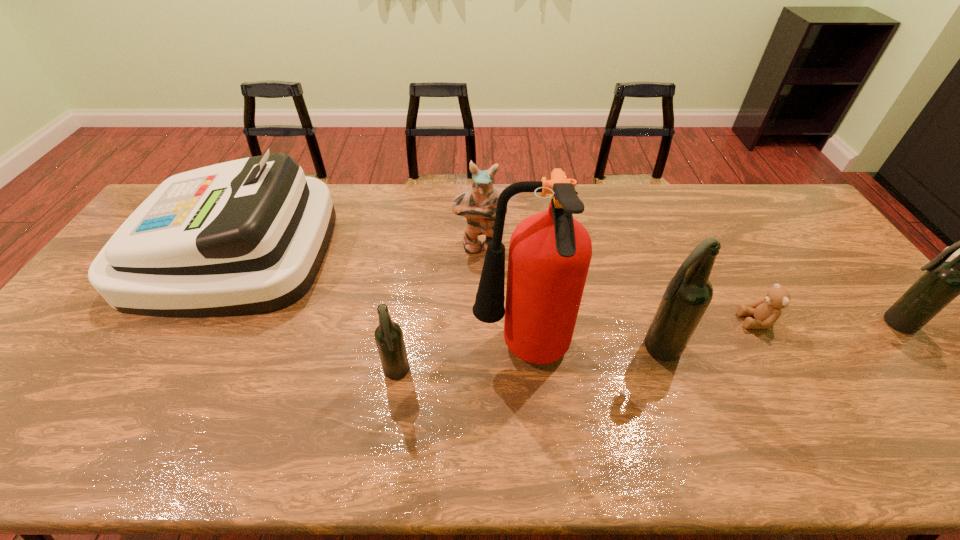
Find the location of `object that is the fourth nearest to the figurine`. object that is the fourth nearest to the figurine is located at coordinates (688, 294).

The image size is (960, 540). In order to click on the second closest object to the figurine in this screenshot , I will do `click(388, 335)`.

Identify which beer bottle is located as the second nearest to the cash register. Please provide its 2D coordinates. Your answer should be formatted as a tuple, i.e. [(x, y)], where the tuple contains the x and y coordinates of a point satisfying the conditions above.

[(688, 294)]

This screenshot has width=960, height=540. I want to click on beer bottle that is the third closest one to the figurine, so click(x=943, y=281).

Image resolution: width=960 pixels, height=540 pixels. I want to click on vacant point that satisfies the following two spatial constraints: 1. on the face of the second shortest beer bottle; 2. on the right side of the shortest object, so click(x=757, y=323).

At what (x,y) coordinates should I click in order to perform the action: click on free space that satisfies the following two spatial constraints: 1. on the front-facing side of the figurine; 2. on the left side of the second beer bottle from left to right. Please return your answer as a coordinate pair (x, y). The height and width of the screenshot is (540, 960). Looking at the image, I should click on (479, 347).